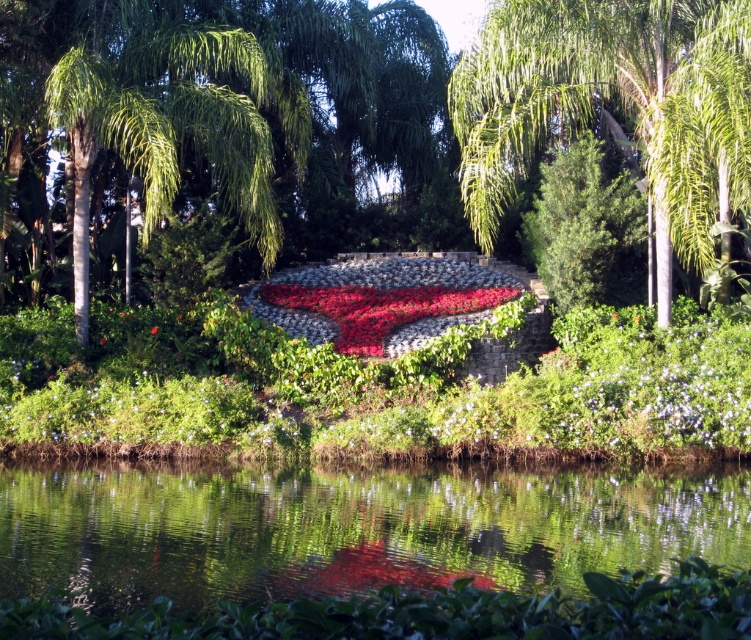
Between point (122, 502) and point (593, 144), which one is positioned in front?

Positioned in front is point (122, 502).

Does green reflective water at center have a greater width compared to green textured bush at center?

Yes, green reflective water at center is wider than green textured bush at center.

Does point (575, 472) come farther from viewer compared to point (575, 177)?

No.

At what (x,y) coordinates should I click in order to perform the action: click on green reflective water at center. Please return your answer as a coordinate pair (x, y). Looking at the image, I should click on (351, 528).

Who is taller, green leafy palm tree at center or red fabric flower at center?

green leafy palm tree at center

Locate an element on the screen. green leafy palm tree at center is located at coordinates (620, 100).

Which is more to the left, red fabric flower at center or green textured bush at center?

red fabric flower at center is more to the left.

Does red fabric flower at center appear on the left side of green textured bush at center?

Yes, red fabric flower at center is to the left of green textured bush at center.

Does point (483, 280) lie in front of point (623, 193)?

No, (483, 280) is behind (623, 193).

Locate an element on the screen. red fabric flower at center is located at coordinates (391, 296).